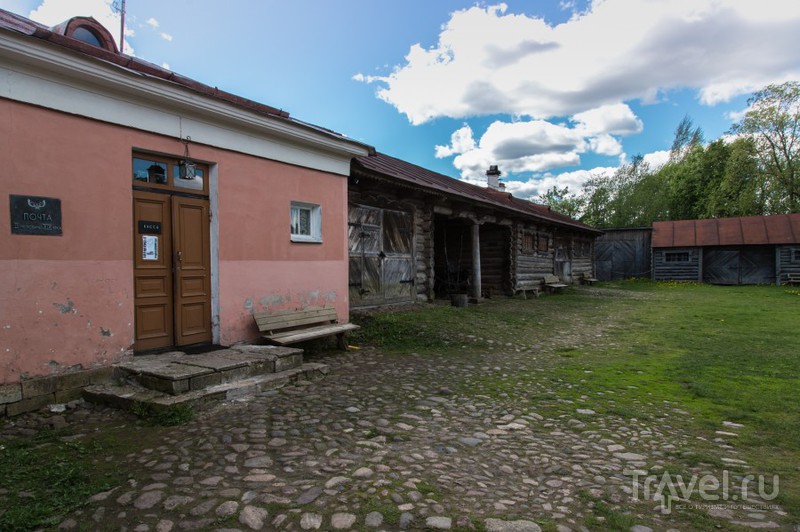
The width and height of the screenshot is (800, 532). What are the coordinates of `metal plaque` in the screenshot? It's located at (26, 217).